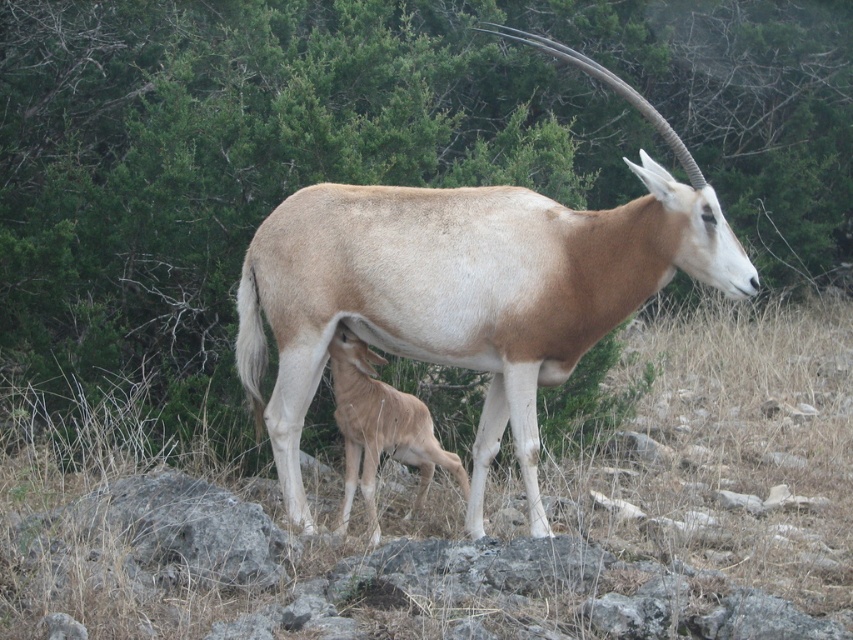
Is point (645, 102) positioned after point (349, 465)?

No, (645, 102) is closer to viewer.

Who is more forward, (468, 208) or (351, 380)?

Point (468, 208) is in front.

The height and width of the screenshot is (640, 853). Identify the location of light brown glossy antelope at center. (469, 288).

Between brown dry grass at center and light brown glossy antelope at center, which one appears on the left side from the viewer's perspective?

brown dry grass at center is more to the left.

Is brown dry grass at center positioned behind light brown glossy antelope at center?

Yes, brown dry grass at center is further from the viewer.

Does point (753, 554) come in front of point (567, 60)?

No, (753, 554) is further to viewer.

At what (x,y) coordinates should I click in order to perform the action: click on brown dry grass at center. Please return your answer as a coordinate pair (x, y). Looking at the image, I should click on (485, 515).

Does brown dry grass at center appear over light brown fur at center?

Indeed, brown dry grass at center is positioned over light brown fur at center.

The height and width of the screenshot is (640, 853). Find the location of `brown dry grass at center`. brown dry grass at center is located at coordinates (485, 515).